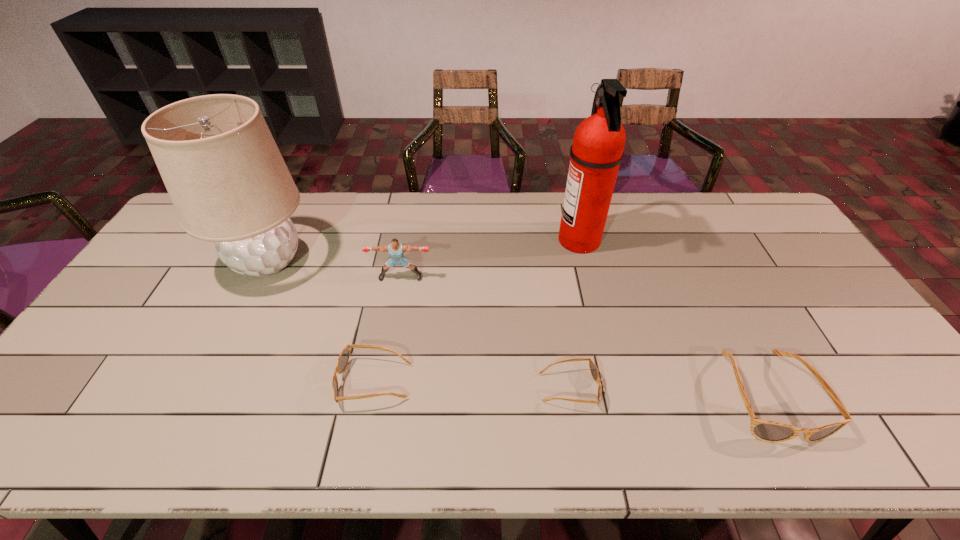
Where is `vacant position at the far edge of the desktop`? The image size is (960, 540). vacant position at the far edge of the desktop is located at coordinates (499, 207).

Where is `vacant space at the near edge`? vacant space at the near edge is located at coordinates [x=623, y=383].

Locate an element on the screen. free spot at the left edge of the desktop is located at coordinates (174, 246).

This screenshot has width=960, height=540. Identify the location of vacant space at the right edge of the desktop. (840, 314).

Where is `free space that is in between the fourth shortest object and the fourth tallest object`? The width and height of the screenshot is (960, 540). free space that is in between the fourth shortest object and the fourth tallest object is located at coordinates (584, 336).

Locate an element on the screen. vacant point located between the shortest sunglasses and the fire extinguisher is located at coordinates (574, 314).

This screenshot has width=960, height=540. What are the coordinates of `free space between the fire extinguisher and the second sunglasses from right to left` in the screenshot? It's located at (574, 314).

Identify the location of free point between the lampshade and the rightmost sunglasses. This screenshot has width=960, height=540. (517, 328).

The image size is (960, 540). In order to click on vacant space that is in between the tallest sunglasses and the puncher in this screenshot , I will do `click(584, 336)`.

At what (x,y) coordinates should I click in order to perform the action: click on empty location between the second shortest object and the lampshade. Please return your answer as a coordinate pair (x, y). Looking at the image, I should click on (321, 321).